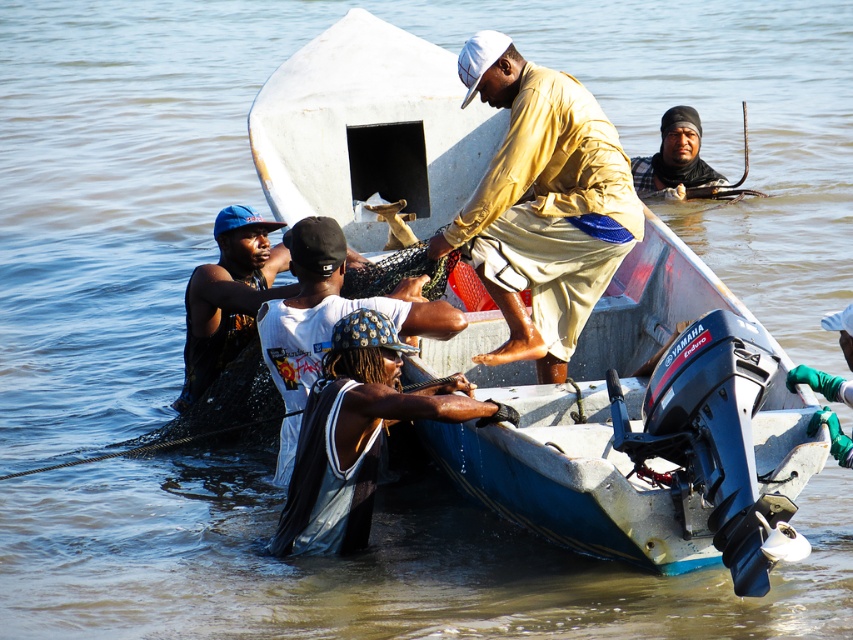
You are a photographer trying to capture a clear shot of both the matte yellow shirt at center and the dark brown leather jacket at upper center. Given their sizes, which one might be easier to focus on and why?

The matte yellow shirt at center is bigger than the dark brown leather jacket at upper center, so it might be easier to focus on because larger objects generally provide more visual detail for the camera to lock onto.

You are a lifeguard on duty and see the image. The dark blue fabric at center and white matte shirt at center are both in the water. Which one is closer to the surface?

The white matte shirt at center is closer to the surface because the dark blue fabric at center is below it.